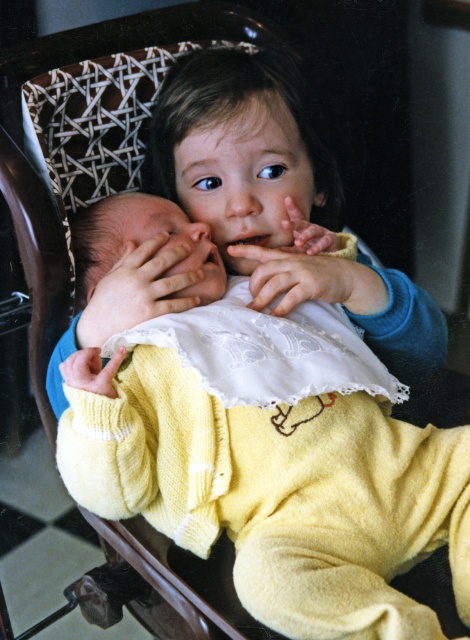
You are a photographer taking a picture of the two children in the wooden chair. You notice the yellow knitted sweater at center and the smooth skin hand at center. Which object should you adjust to ensure both are centered in the frame?

The yellow knitted sweater at center is to the right of the smooth skin hand at center, so you should move the yellow knitted sweater at center to the left to align both objects in the center of the frame.

You are a photographer adjusting your camera to focus on two points in the image. The first point is point (130, 195) and the second is point (128, 262). Which point is closer to your camera?

Point (130, 195) is closer to the camera than point (128, 262).

You are a photographer setting up for a family portrait. You need to ensure that the yellow knitted sweater at center and the smooth skin hand at center are both visible in the frame. Based on their positions, which object should you focus on first to ensure both are in focus?

The yellow knitted sweater at center is below the smooth skin hand at center. To ensure both are in focus, focus on the smooth skin hand at center first since it is closer to the camera, and the sweater will naturally fall within the depth of field.